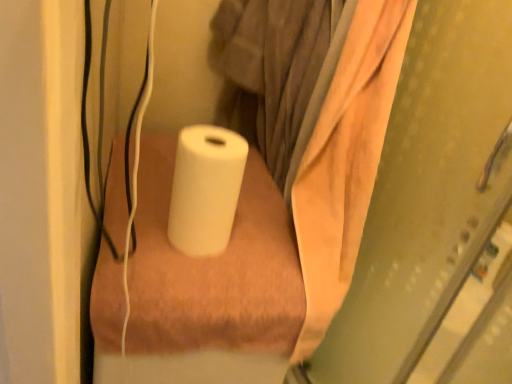
Find the location of a particular element. The image size is (512, 384). free space in front of white matte paper towel at center is located at coordinates (183, 269).